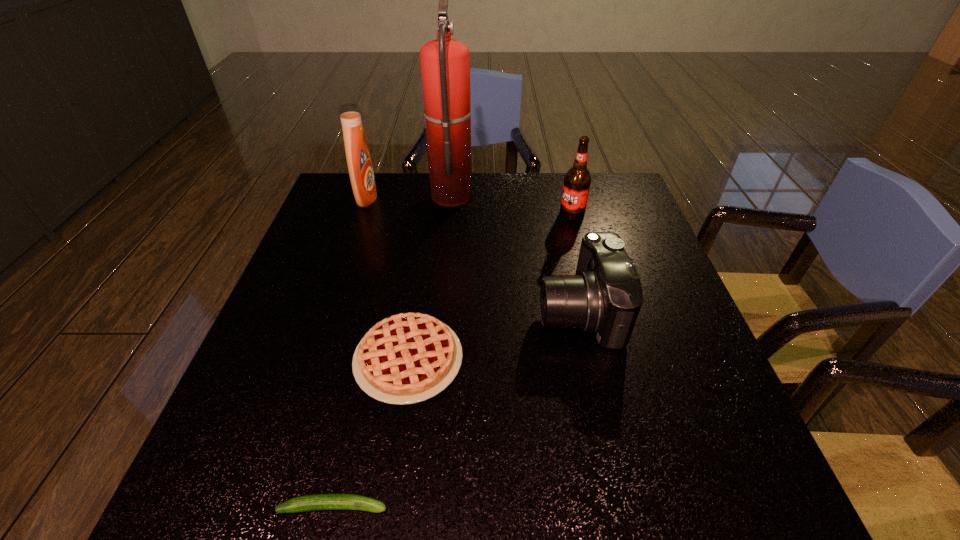
Where is `zucchini at the left edge`? The height and width of the screenshot is (540, 960). zucchini at the left edge is located at coordinates (319, 501).

In order to click on object that is at the right edge in this screenshot , I will do `click(605, 296)`.

I want to click on object present at the far left corner, so click(x=359, y=163).

Where is `object situated at the near left corner`? The height and width of the screenshot is (540, 960). object situated at the near left corner is located at coordinates (319, 501).

Where is `vacant space at the far edge`? vacant space at the far edge is located at coordinates (482, 176).

In the image, there is a desktop. Identify the location of free space at the near edge. Image resolution: width=960 pixels, height=540 pixels. (404, 465).

In the image, there is a desktop. Identify the location of vacant space at the left edge. This screenshot has width=960, height=540. (358, 264).

Locate an element on the screen. The height and width of the screenshot is (540, 960). vacant space at the right edge of the desktop is located at coordinates (649, 384).

You are a GUI agent. You are given a task and a screenshot of the screen. Output one action in this format:
    pyautogui.click(x=<x>, y=<y>)
    Task: Click on the free space at the far left corner
    Image resolution: width=960 pixels, height=540 pixels.
    Given the screenshot: What is the action you would take?
    pyautogui.click(x=340, y=173)

At what (x,y) coordinates should I click in order to perform the action: click on blank space at the far right corner of the desktop. Please return your answer as a coordinate pair (x, y). This screenshot has height=540, width=960. Looking at the image, I should click on (609, 174).